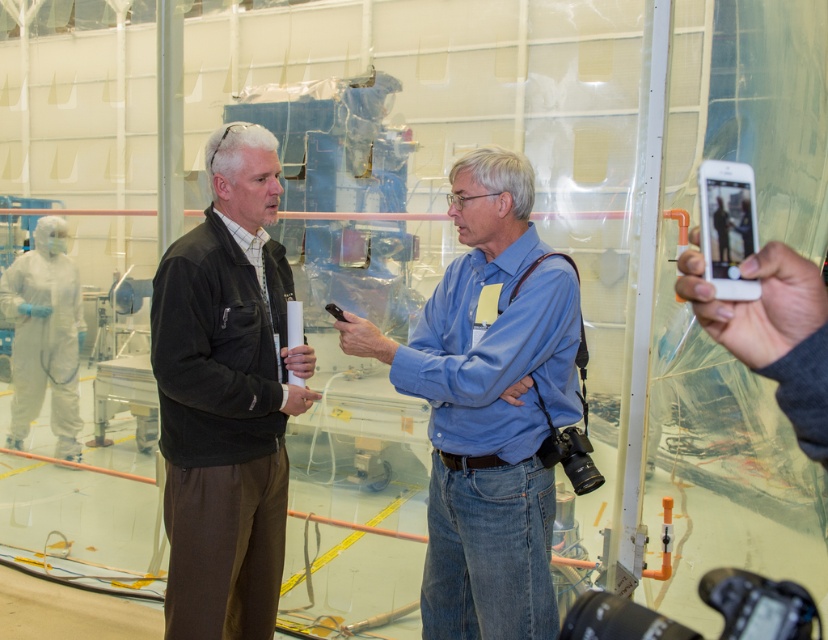
You are a safety inspector in the cleanroom. You need to ensure that the blue denim jeans at center and the dark brown corduroy jacket at center do not exceed the width limit of the cleanroom entrance, which is 1.2 meters. Can you confirm if both items are within the allowed width?

The blue denim jeans at center might be wider than dark brown corduroy jacket at center, but since the exact widths are not provided, it is uncertain if they comply with the 1.2 meters width limit. Further measurements are needed to confirm compliance.

You are a security guard tasked with ensuring that all personnel are properly positioned within the cleanroom. According to the scene, where is the blue denim jeans at center relative to the dark brown corduroy jacket at center?

The blue denim jeans at center is to the right of the dark brown corduroy jacket at center.

You are a technician in the cleanroom. You need to reach both the white glossy phone at upper right and the black plastic pen at center to perform a task. Which object should you reach for first if you want to grab the one closer to you?

The white glossy phone at upper right is in front of the black plastic pen at center, so it is closer to you. You should reach for the white glossy phone at upper right first.